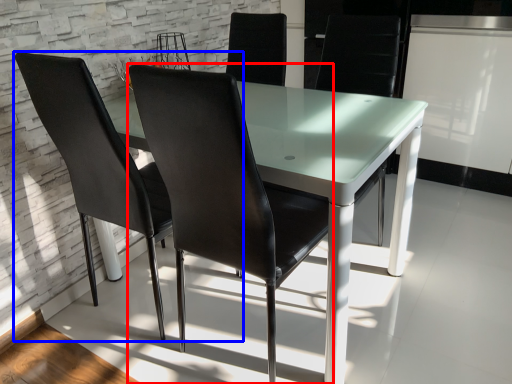
Question: Which point is closer to the camera, chair (highlighted by a red box) or chair (highlighted by a blue box)?

Choices:
 (A) chair
 (B) chair

Answer: (A)